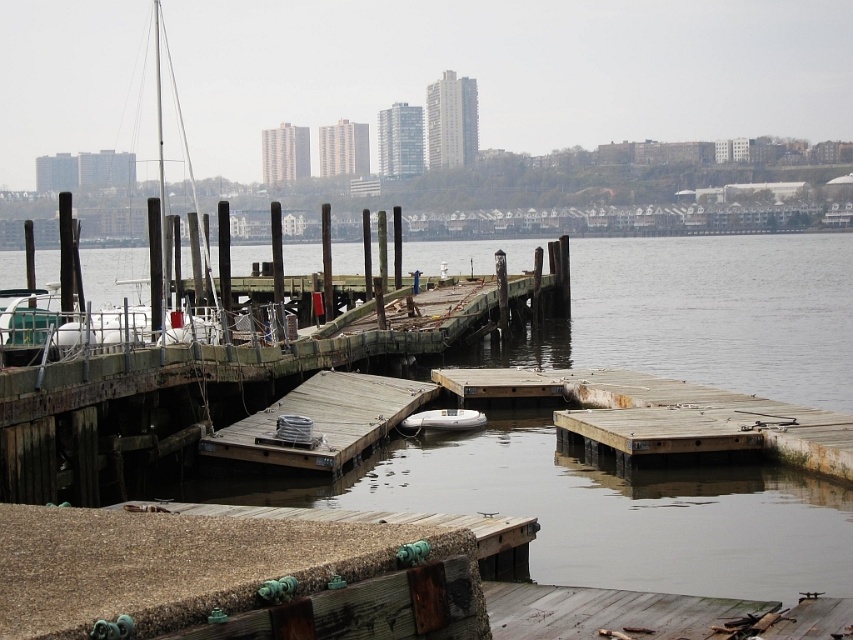
You are standing at the edge of the dock and see the point at coordinates point (606, 512). What is the color of the surface at that point?

The point (606, 512) is on brown murky water at center, so the color of the surface at that point is brown.

You are standing at the point marked as point (606, 512). What do you see directly below you?

At point (606, 512) lies brown murky water at center.

You are standing on the concrete edge with metal fixtures and see the brown murky water at center and the rusty wood dock at center. Which object is located to the left of the other?

The brown murky water at center is positioned on the left side of rusty wood dock at center.